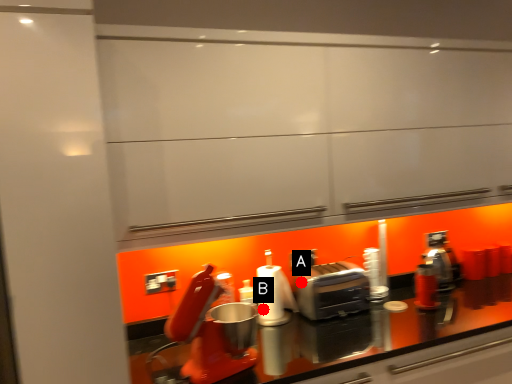
Question: Two points are circled on the image, labeled by A and B beside each circle. Which point is closer to the camera?

Choices:
 (A) A is closer
 (B) B is closer

Answer: (B)